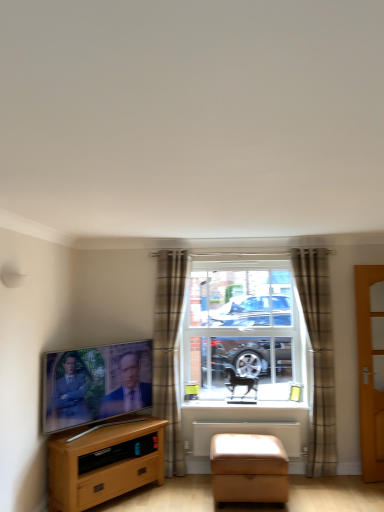
Question: Is tan leather footrest at lower center wider or thinner than clear glass window at center?

Choices:
 (A) wide
 (B) thin

Answer: (A)

Question: Relative to clear glass window at center, is tan leather footrest at lower center in front or behind?

Choices:
 (A) behind
 (B) front

Answer: (B)

Question: Based on their relative distances, which object is nearer to the white plastic radiator at lower center?

Choices:
 (A) wooden door at right
 (B) brown plaid curtain at center, the 1th curtain from the right
 (C) plaid fabric curtain at center, the 1th curtain in the left-to-right sequence
 (D) white plastic window sill at center
 (E) light brown wood tv stand at lower left

Answer: (D)

Question: Based on their relative distances, which object is nearer to the matte black tv at left?

Choices:
 (A) tan leather footrest at lower center
 (B) brown plaid curtain at center, the 1th curtain from the right
 (C) wooden door at right
 (D) clear glass window at center
 (E) white plastic window sill at center

Answer: (E)